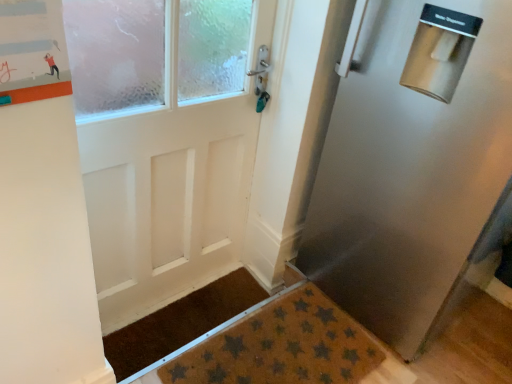
In order to click on vacant point above brown textured doormat at lower center, which appears as the first doormat when viewed from the front (from a real-world perspective) in this screenshot , I will do `click(278, 345)`.